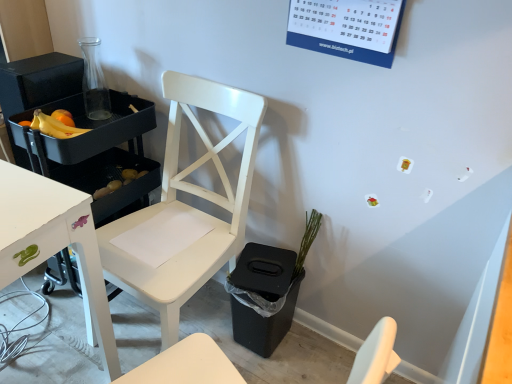
Question: Considering the relative sizes of white matte chair at center and yellow matte potatoes at lower left in the image provided, is white matte chair at center thinner than yellow matte potatoes at lower left?

Choices:
 (A) no
 (B) yes

Answer: (A)

Question: Does white matte chair at center have a smaller size compared to yellow matte potatoes at lower left?

Choices:
 (A) yes
 (B) no

Answer: (B)

Question: From a real-world perspective, is white matte chair at center beneath yellow matte potatoes at lower left?

Choices:
 (A) no
 (B) yes

Answer: (A)

Question: Can you confirm if white matte chair at center is positioned to the left of yellow matte potatoes at lower left?

Choices:
 (A) no
 (B) yes

Answer: (A)

Question: Is white matte chair at center turned away from yellow matte potatoes at lower left?

Choices:
 (A) no
 (B) yes

Answer: (A)

Question: From a real-world perspective, is white matte chair at center physically above yellow matte potatoes at lower left?

Choices:
 (A) yes
 (B) no

Answer: (A)

Question: From a real-world perspective, is yellow matte potatoes at lower left physically above white matte chair at center?

Choices:
 (A) yes
 (B) no

Answer: (B)

Question: Is yellow matte potatoes at lower left in contact with white matte chair at center?

Choices:
 (A) no
 (B) yes

Answer: (A)

Question: Does yellow matte potatoes at lower left have a lesser width compared to white matte chair at center?

Choices:
 (A) no
 (B) yes

Answer: (B)

Question: Does yellow matte potatoes at lower left have a smaller size compared to white matte chair at center?

Choices:
 (A) yes
 (B) no

Answer: (A)

Question: From the image's perspective, is yellow matte potatoes at lower left located beneath white matte chair at center?

Choices:
 (A) no
 (B) yes

Answer: (A)

Question: Could you tell me if yellow matte potatoes at lower left is facing white matte chair at center?

Choices:
 (A) yes
 (B) no

Answer: (B)

Question: From a real-world perspective, is yellow matte bananas at left on top of white matte chair at center?

Choices:
 (A) yes
 (B) no

Answer: (A)